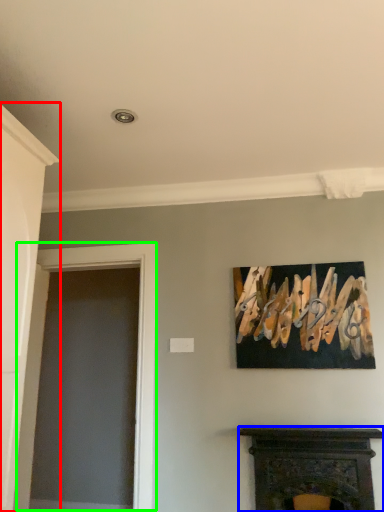
Question: Which is farther away from door (highlighted by a red box)? fireplace (highlighted by a blue box) or glass door (highlighted by a green box)?

Choices:
 (A) fireplace
 (B) glass door

Answer: (A)